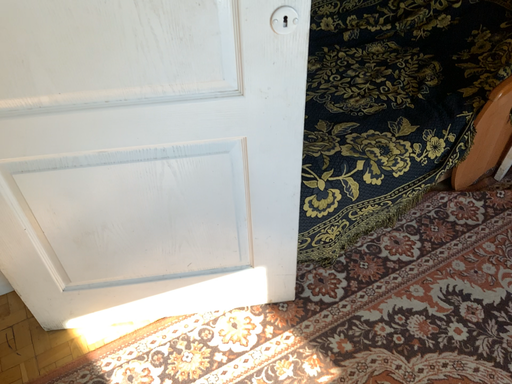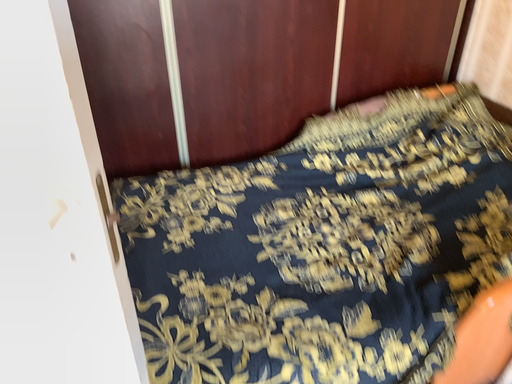
Question: Which way did the camera rotate in the video?

Choices:
 (A) rotated downward
 (B) rotated upward

Answer: (B)